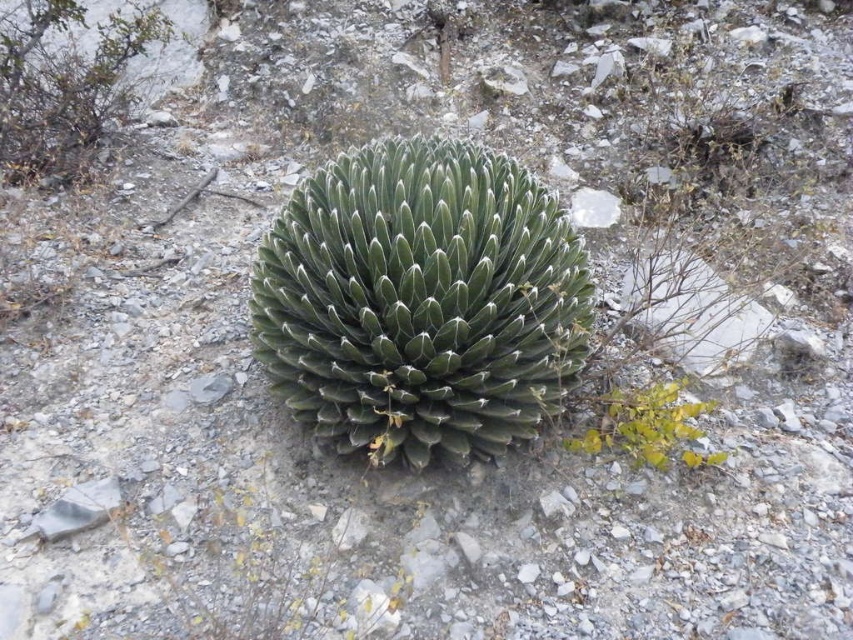
In the scene shown: Who is more forward, (9,170) or (694,465)?

Answer: Point (694,465) is in front.

Does green spiky cactus at upper left have a lesser height compared to green leafy plant at lower right?

Incorrect, green spiky cactus at upper left's height does not fall short of green leafy plant at lower right's.

Measure the distance between point (67, 134) and camera.

They are 5.68 meters apart.

What are the coordinates of `green spiky cactus at upper left` in the screenshot? It's located at (67, 83).